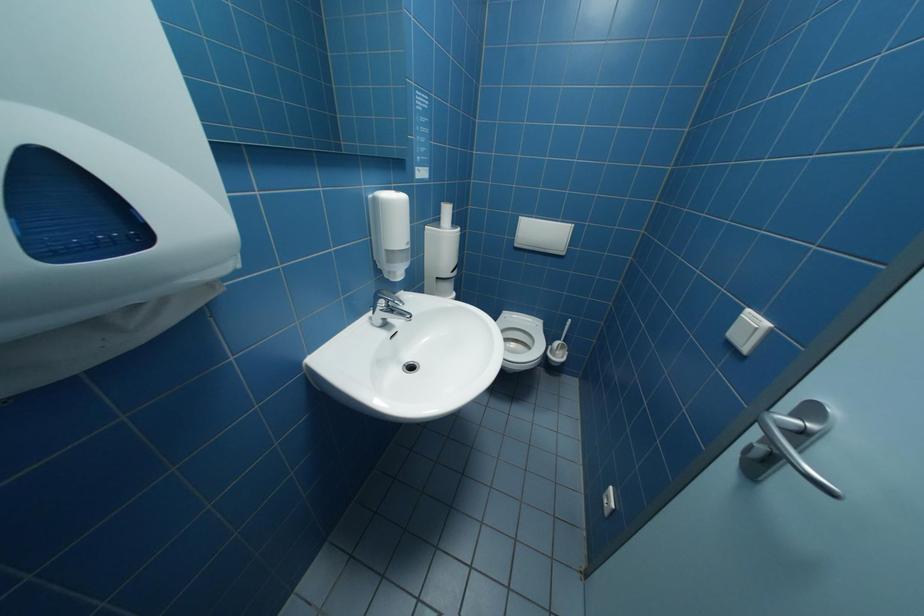
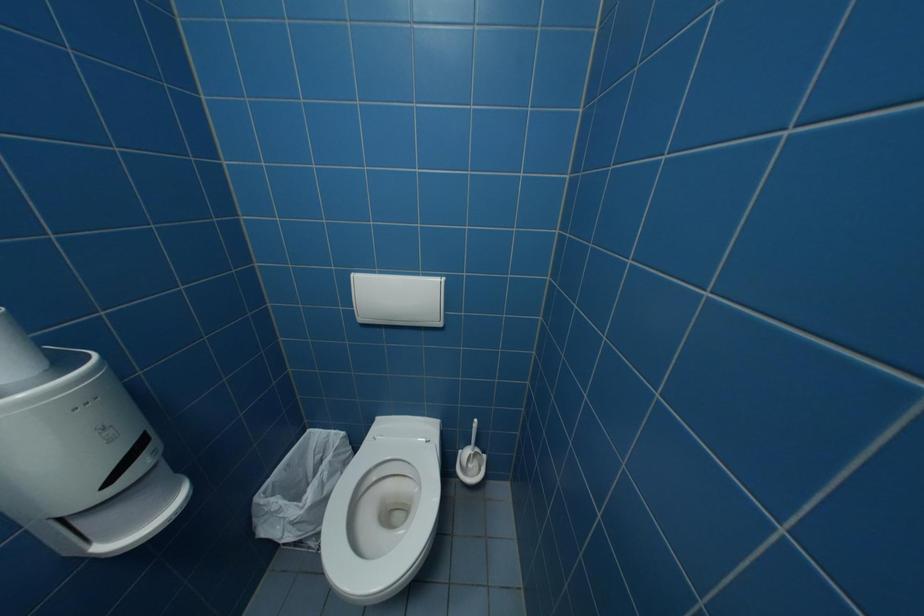
What movement of the cameraman would produce the second image?

The movement direction of the cameraman is right, forward.